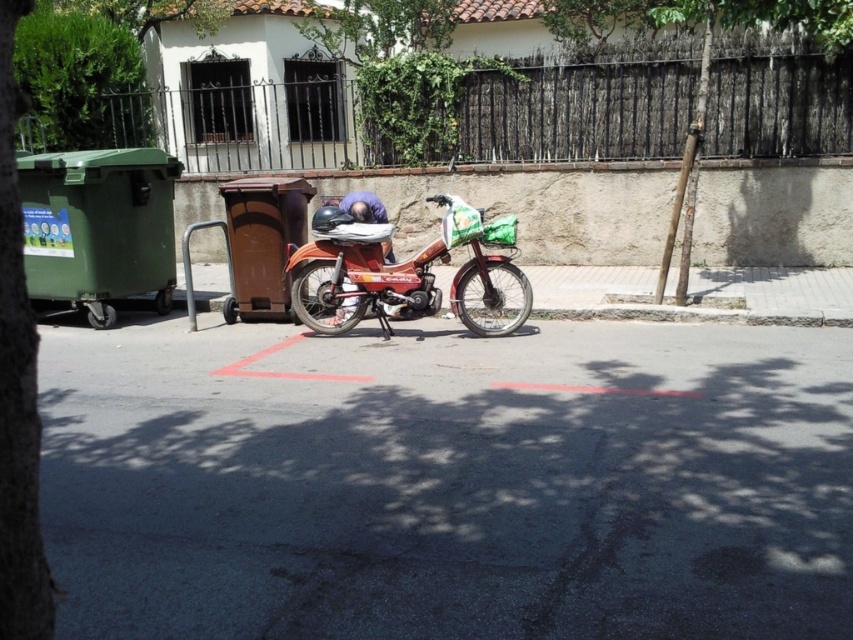
Consider the image. Is green leafy tree at left in front of matte orange motorcycle at center?

Yes, it is.

Is point (9, 90) closer to viewer compared to point (514, 230)?

That is True.

Identify the location of green leafy tree at left. Image resolution: width=853 pixels, height=640 pixels. click(16, 385).

Does matte orange motorcycle at center have a smaller size compared to green leafy tree at upper center?

No, matte orange motorcycle at center is not smaller than green leafy tree at upper center.

Does matte orange motorcycle at center have a lesser height compared to green leafy tree at upper center?

Yes.

Locate an element on the screen. matte orange motorcycle at center is located at coordinates (403, 275).

Is green leafy tree at left bigger than green leafy tree at upper center?

No, green leafy tree at left is not bigger than green leafy tree at upper center.

Between point (22, 620) and point (363, 83), which one is positioned in front?

Point (22, 620) is more forward.

In order to click on green leafy tree at left in this screenshot , I will do `click(16, 385)`.